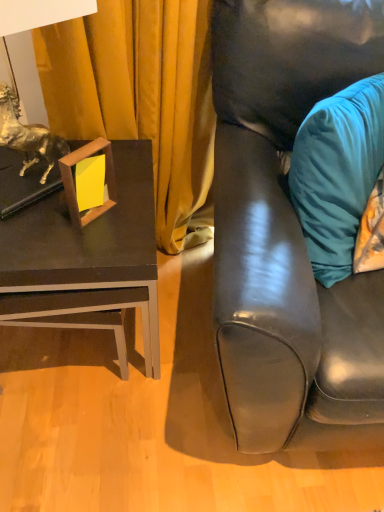
Image resolution: width=384 pixels, height=512 pixels. I want to click on free spot to the right of matte black table at left, so click(196, 340).